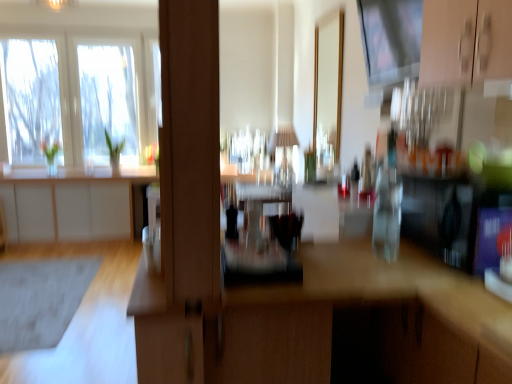
Question: Is transparent glass window screen at upper center wider or thinner than clear glass window at upper left?

Choices:
 (A) wide
 (B) thin

Answer: (A)

Question: Is transparent glass window screen at upper center situated inside clear glass window at upper left or outside?

Choices:
 (A) inside
 (B) outside

Answer: (B)

Question: Estimate the real-world distances between objects in this image. Which object is closer to the wooden desk at center?

Choices:
 (A) gray matte rug at lower left
 (B) white matte cabinet at left
 (C) transparent glass window screen at upper center
 (D) clear glass window at upper left

Answer: (C)

Question: Based on their relative distances, which object is farther from the wooden desk at center?

Choices:
 (A) white matte cabinet at left
 (B) transparent glass window screen at upper center
 (C) gray matte rug at lower left
 (D) clear glass window at upper left

Answer: (D)